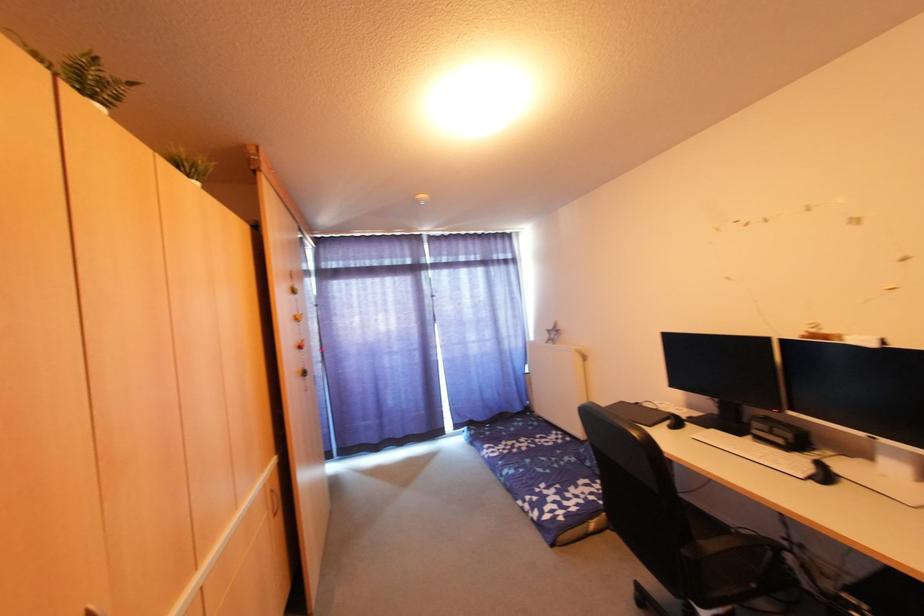
This screenshot has width=924, height=616. Identify the location of cabinet door handle. (274, 511).